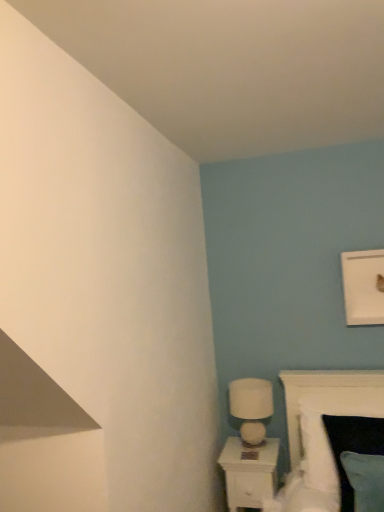
The height and width of the screenshot is (512, 384). Identify the location of blank space above white glossy nightstand at lower right (from a real-world perspective). (246, 448).